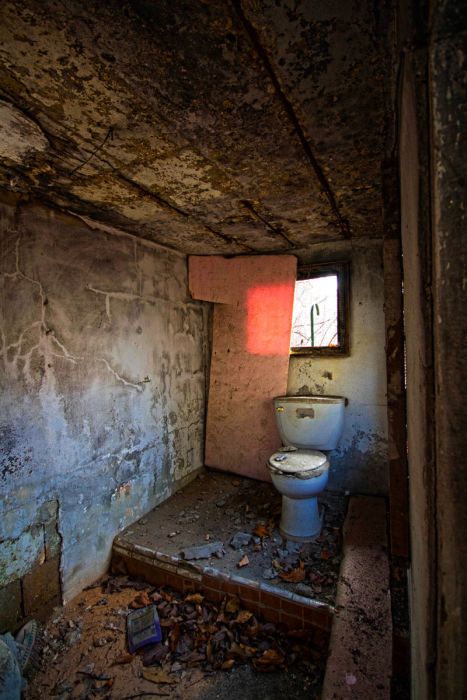
Where is `toilet tank`? The height and width of the screenshot is (700, 467). toilet tank is located at coordinates (314, 426).